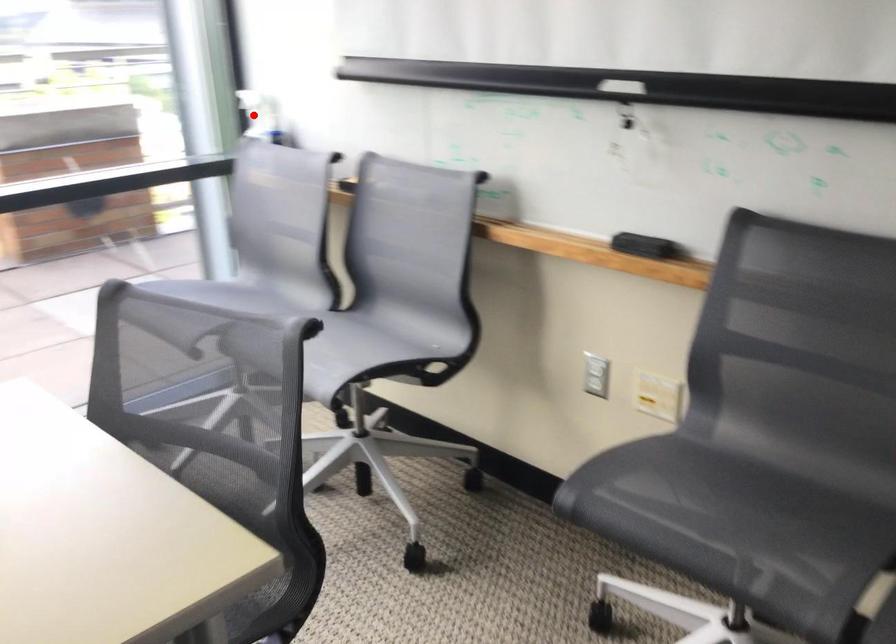
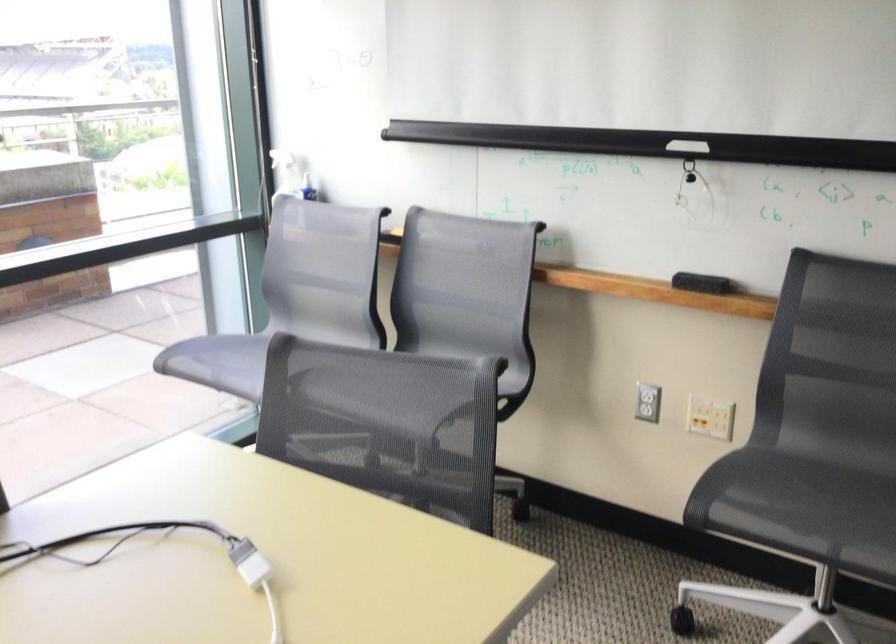
Find the pixel in the second image that matches the highlighted location in the first image.

(287, 174)